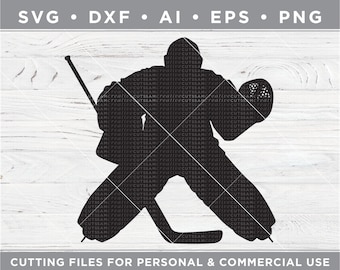
This screenshot has width=340, height=270. I want to click on handle, so (71, 69).